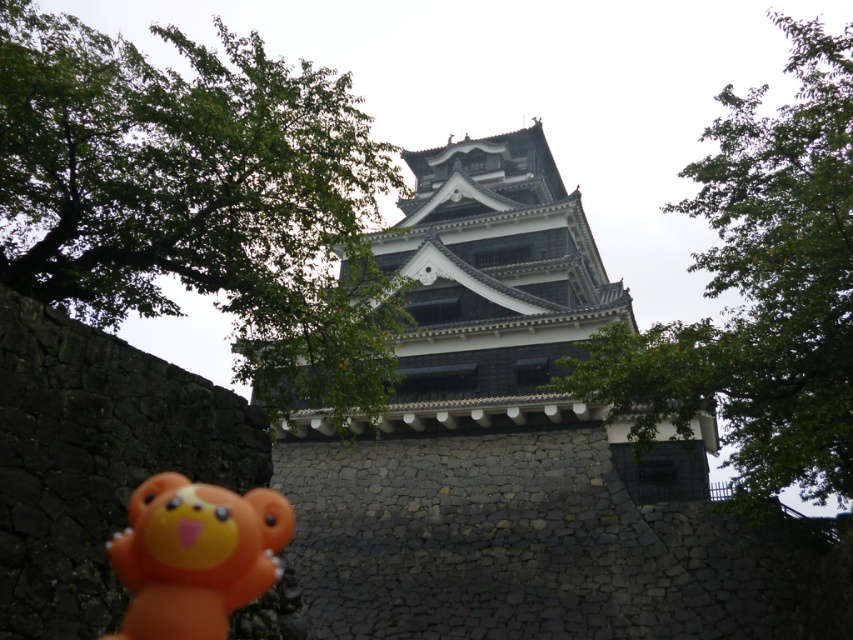
You are a photographer trying to capture a clear shot of the orange rubber bear at lower left and the green leafy tree at upper right. However, the bear is partially obscured by the tree. Can you adjust your position to see both objects clearly without any obstruction?

The orange rubber bear at lower left is behind the green leafy tree at upper right, so moving your position to the side or closer to the bear might allow you to see both objects without obstruction.